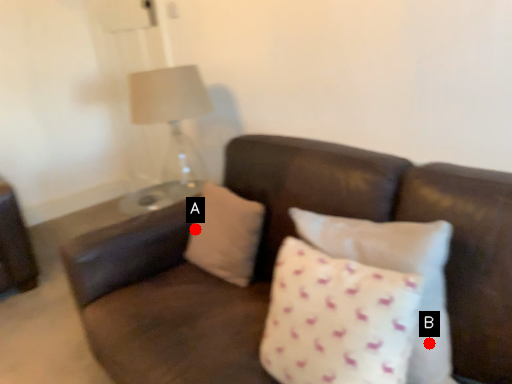
Question: Two points are circled on the image, labeled by A and B beside each circle. Which point is farther from the camera taking this photo?

Choices:
 (A) A is further
 (B) B is further

Answer: (A)